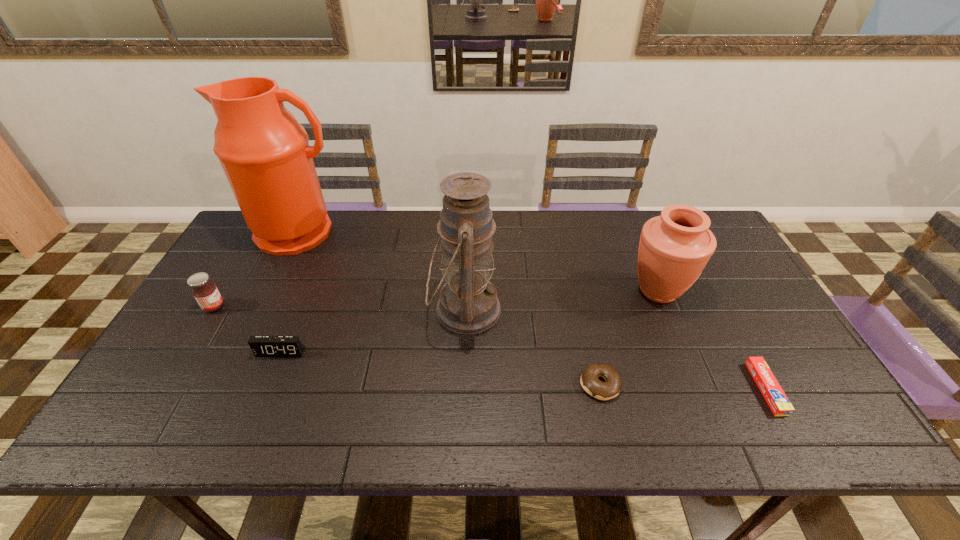
What are the coordinates of `water jug` in the screenshot? It's located at (264, 152).

At what (x,y) coordinates should I click in order to perform the action: click on the fourth object from left to right. Please return your answer as a coordinate pair (x, y). Looking at the image, I should click on (468, 304).

This screenshot has width=960, height=540. I want to click on the sixth shortest object, so click(x=468, y=304).

The height and width of the screenshot is (540, 960). I want to click on vase, so click(674, 248).

Image resolution: width=960 pixels, height=540 pixels. Find the location of `the fifth shortest object`. the fifth shortest object is located at coordinates (674, 248).

Identify the location of the fourth shortest object. (x=205, y=292).

The width and height of the screenshot is (960, 540). In order to click on the third shortest object in this screenshot , I will do `click(262, 346)`.

Image resolution: width=960 pixels, height=540 pixels. Identify the location of the sixth tallest object. (589, 380).

The width and height of the screenshot is (960, 540). What are the coordinates of `doughnut` in the screenshot? It's located at (589, 380).

This screenshot has width=960, height=540. In order to click on the rightmost object in this screenshot , I will do `click(774, 395)`.